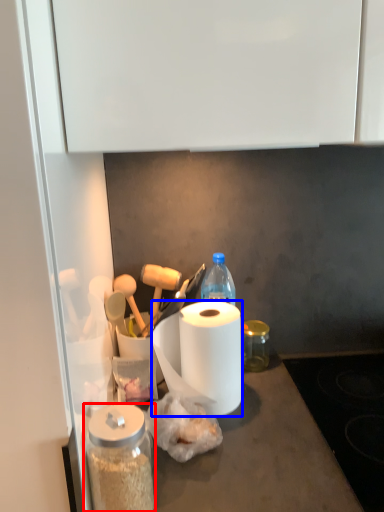
Question: Which object appears closest to the camera in this image, glass jar (highlighted by a red box) or paper towel (highlighted by a blue box)?

Choices:
 (A) glass jar
 (B) paper towel

Answer: (A)